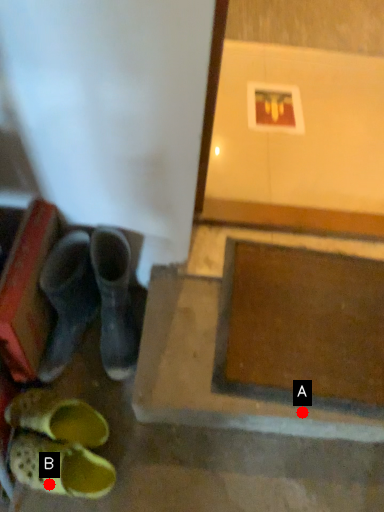
Question: Two points are circled on the image, labeled by A and B beside each circle. Which point is closer to the camera?

Choices:
 (A) A is closer
 (B) B is closer

Answer: (B)